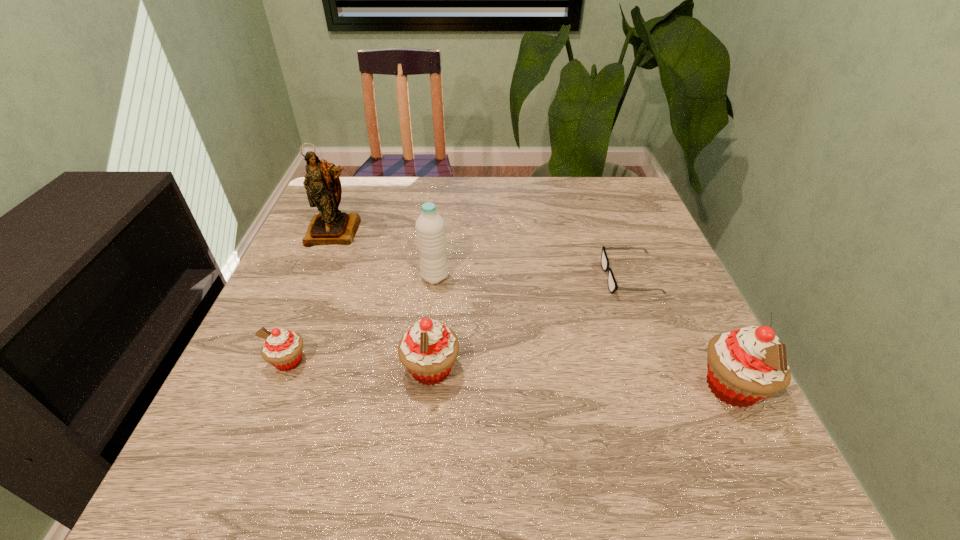
This screenshot has width=960, height=540. Find the location of `cupcake identified as the second closest to the shortest object`. cupcake identified as the second closest to the shortest object is located at coordinates (428, 350).

The image size is (960, 540). What are the coordinates of `the second closest cupcake to the spectacles` in the screenshot? It's located at (428, 350).

Where is `vacant space that satisfies the following two spatial constraints: 1. on the front side of the shortest cupcake; 2. on the right side of the rightmost cupcake`? This screenshot has height=540, width=960. vacant space that satisfies the following two spatial constraints: 1. on the front side of the shortest cupcake; 2. on the right side of the rightmost cupcake is located at coordinates (278, 387).

In order to click on blank space that satisfies the following two spatial constraints: 1. on the front side of the second tallest cupcake; 2. on the right side of the leftmost cupcake in this screenshot , I will do `click(285, 369)`.

The width and height of the screenshot is (960, 540). Identify the location of vacant space that satisfies the following two spatial constraints: 1. on the front side of the third shortest object; 2. on the left side of the leftmost cupcake. 285,369.

Identify the location of free region that satisfies the following two spatial constraints: 1. on the back side of the fifth tallest object; 2. on the left side of the water bottle. (322, 277).